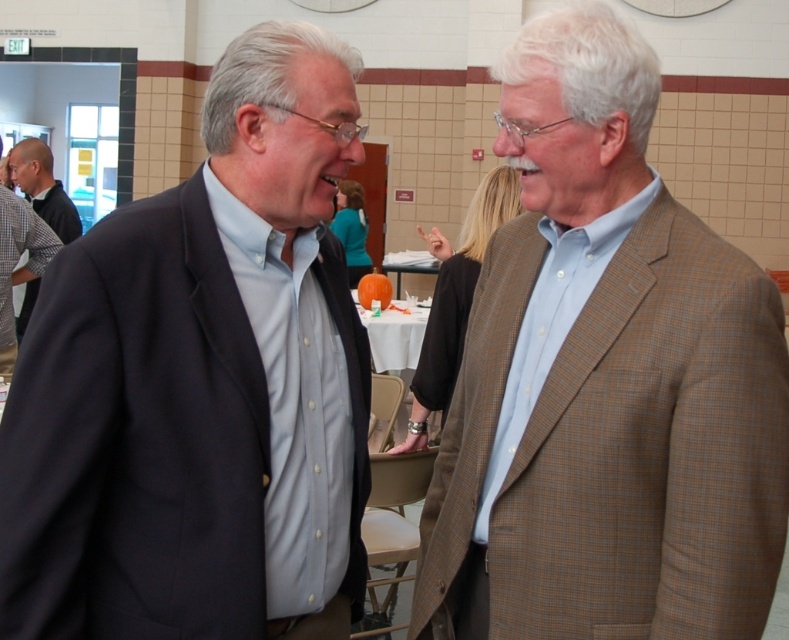
Question: Which object is closer to the camera taking this photo?

Choices:
 (A) matte black suit at left
 (B) light brown checkered blazer at center
 (C) checkered shirt at left

Answer: (A)

Question: Which point appears closest to the camera in this image?

Choices:
 (A) (597, 563)
 (B) (47, 170)

Answer: (A)

Question: Does matte black suit at left come in front of checkered shirt at left?

Choices:
 (A) no
 (B) yes

Answer: (B)

Question: Is light brown checkered blazer at center smaller than checkered shirt at left?

Choices:
 (A) yes
 (B) no

Answer: (A)

Question: Which point appears closest to the camera in this image?

Choices:
 (A) (682, 262)
 (B) (267, 474)
 (C) (66, 211)

Answer: (B)

Question: Can you confirm if light brown checkered blazer at center is positioned below checkered shirt at left?

Choices:
 (A) yes
 (B) no

Answer: (A)